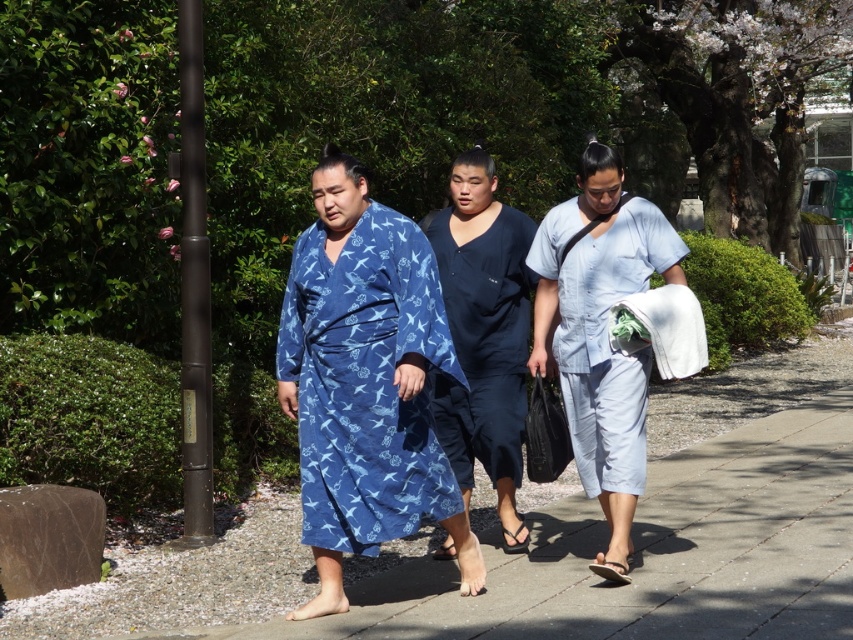
Between blue printed robe at center and light blue fabric at center, which one has less height?

light blue fabric at center

Measure the distance between blue printed robe at center and light blue fabric at center.

They are 36.19 inches apart.

This screenshot has height=640, width=853. I want to click on blue printed robe at center, so click(366, 381).

Does blue printed robe at center have a lesser height compared to dark blue fabric at center?

No.

Who is taller, blue printed robe at center or dark blue fabric at center?

blue printed robe at center

Is point (401, 250) positioned in front of point (498, 426)?

Yes, point (401, 250) is closer to viewer.

You are a GUI agent. You are given a task and a screenshot of the screen. Output one action in this format:
    pyautogui.click(x=<x>, y=<y>)
    Task: Click on the blue printed robe at center
    This screenshot has height=640, width=853.
    Given the screenshot: What is the action you would take?
    pyautogui.click(x=366, y=381)

In the scene shown: Is light blue fabric at center closer to camera compared to dark blue fabric at center?

That is True.

Find the location of a particular element. The height and width of the screenshot is (640, 853). light blue fabric at center is located at coordinates (601, 332).

Between point (643, 420) and point (457, 310), which one is positioned behind?

The point (457, 310) is more distant.

I want to click on light blue fabric at center, so click(x=601, y=332).